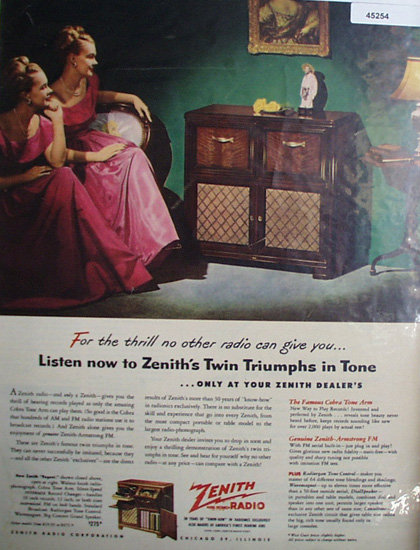
The height and width of the screenshot is (550, 420). In order to click on drawer in this screenshot , I will do `click(302, 150)`, `click(227, 152)`.